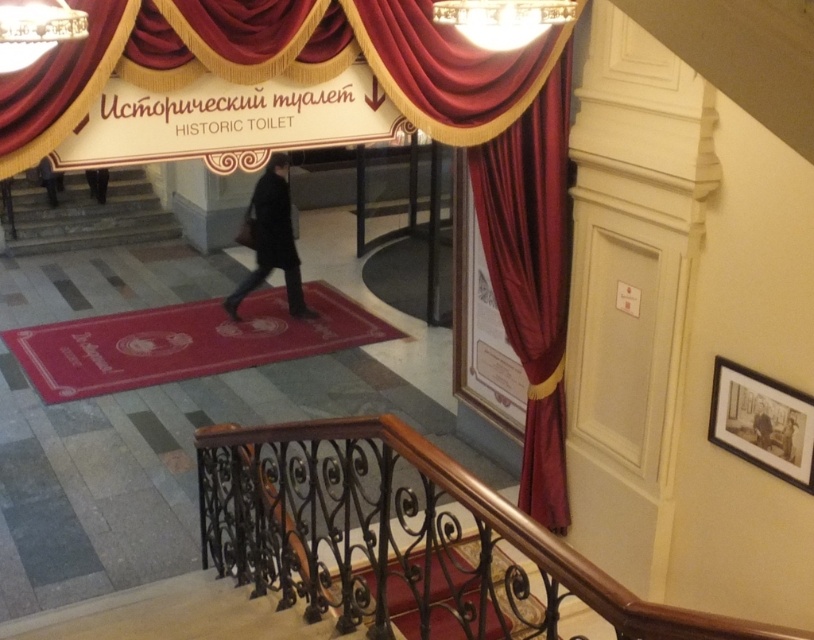
Question: Is velvet red curtain at upper left positioned in front of dark gray fabric coat at lower left?

Choices:
 (A) no
 (B) yes

Answer: (B)

Question: Which point appears closest to the camera in this image?

Choices:
 (A) (97, 186)
 (B) (519, 282)
 (C) (125, 22)

Answer: (C)

Question: Which point is farther to the camera?

Choices:
 (A) black leather coat at center
 (B) velvet red curtain at upper left
 (C) dark gray fabric coat at lower left

Answer: (C)

Question: Where is velvet curtain at right located in relation to velvet red curtain at upper left in the image?

Choices:
 (A) left
 (B) right

Answer: (B)

Question: Estimate the real-world distances between objects in this image. Which object is farther from the velvet curtain at right?

Choices:
 (A) velvet red curtain at upper left
 (B) black wrought iron railing at center
 (C) black leather coat at center
 (D) dark gray fabric coat at lower left

Answer: (D)

Question: Is dark gray fabric coat at lower left thinner than black leather coat at center?

Choices:
 (A) yes
 (B) no

Answer: (A)